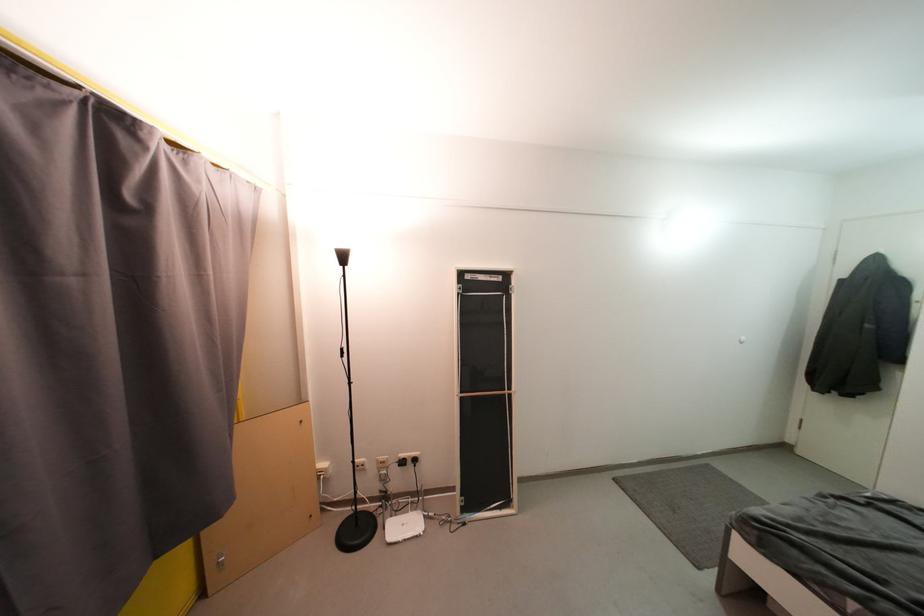
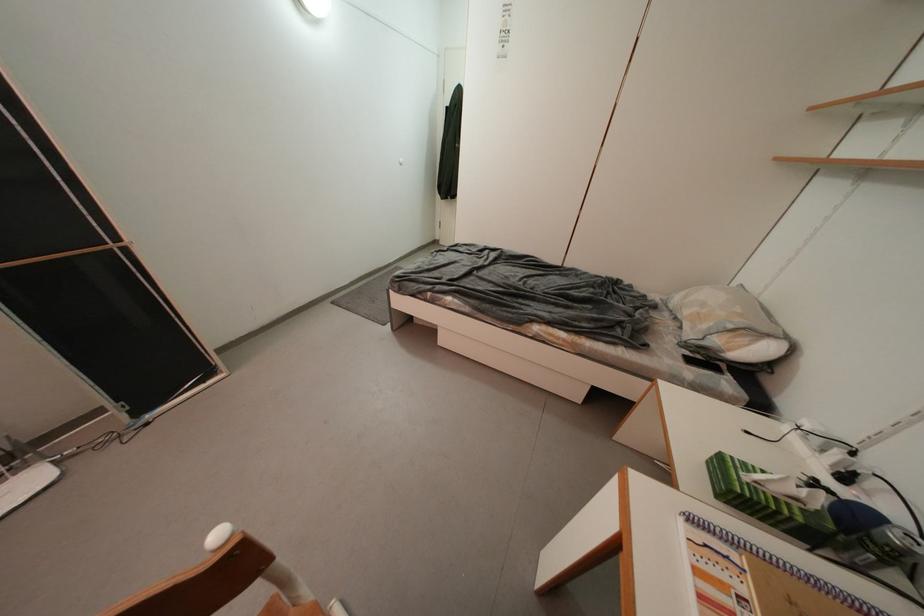
The first image is from the beginning of the video and the second image is from the end. How did the camera likely rotate when shooting the video?

The rotation direction of the camera is right-down.